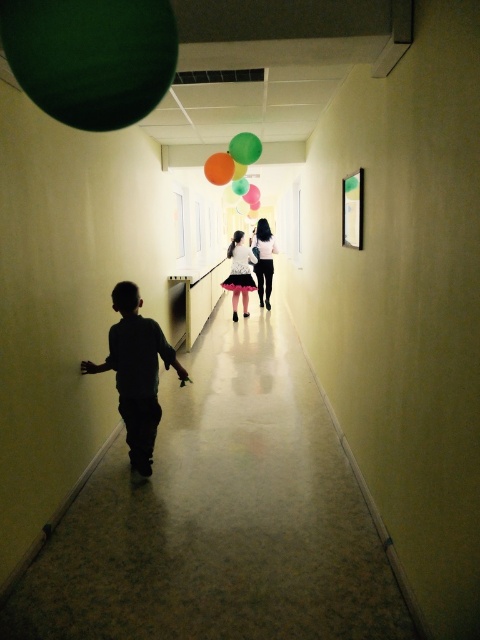
Question: Is green matte balloon at upper left to the left of green matte balloon at upper center from the viewer's perspective?

Choices:
 (A) no
 (B) yes

Answer: (B)

Question: Which object is the farthest from the silhouette cotton shirt at center?

Choices:
 (A) green matte balloon at upper center
 (B) green matte balloon at center

Answer: (A)

Question: Estimate the real-world distances between objects in this image. Which object is farther from the green matte balloon at upper center?

Choices:
 (A) silhouette cotton shirt at center
 (B) green matte balloon at center

Answer: (A)

Question: Is silhouette cotton shirt at center closer to the viewer compared to green matte balloon at upper center?

Choices:
 (A) yes
 (B) no

Answer: (A)

Question: Which object appears closest to the camera in this image?

Choices:
 (A) translucent orange balloon at center
 (B) green matte balloon at upper center
 (C) green matte balloon at center
 (D) silhouette cotton shirt at center

Answer: (D)

Question: Is green matte balloon at upper left to the left of translucent orange balloon at center from the viewer's perspective?

Choices:
 (A) yes
 (B) no

Answer: (A)